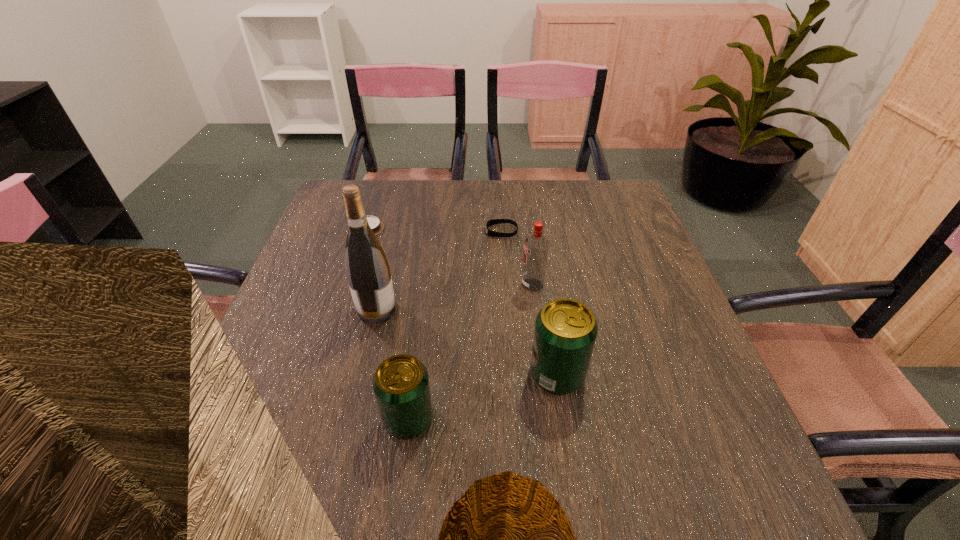
Find the location of `vacant area that satisfies the following two spatial constraints: 1. on the label of the right beer can; 2. on the left side of the tallest object`. vacant area that satisfies the following two spatial constraints: 1. on the label of the right beer can; 2. on the left side of the tallest object is located at coordinates (361, 374).

What are the coordinates of `free space that satisfies the following two spatial constraints: 1. on the front side of the right beer can; 2. on the right side of the chocolate cake` in the screenshot? It's located at (321, 374).

Locate an element on the screen. The image size is (960, 540). free spot that satisfies the following two spatial constraints: 1. on the label of the tallest object; 2. on the right side of the third object from left to right is located at coordinates 350,418.